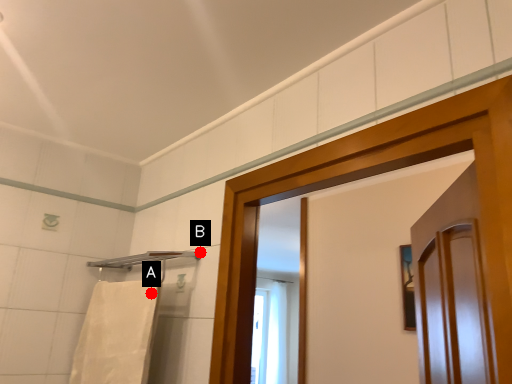
Question: Two points are circled on the image, labeled by A and B beside each circle. Which point is further to the camera?

Choices:
 (A) A is further
 (B) B is further

Answer: (B)